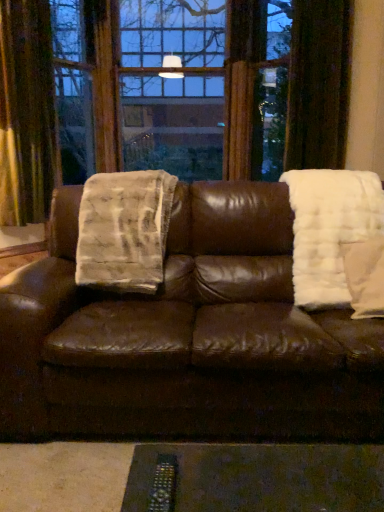
Question: Is white fluffy pillow at right shorter than velvet gold curtain at left?

Choices:
 (A) yes
 (B) no

Answer: (A)

Question: From the image's perspective, would you say white fluffy pillow at right is shown under velvet gold curtain at left?

Choices:
 (A) no
 (B) yes

Answer: (B)

Question: From the image's perspective, is white fluffy pillow at right above velvet gold curtain at left?

Choices:
 (A) yes
 (B) no

Answer: (B)

Question: From a real-world perspective, does white fluffy pillow at right stand above velvet gold curtain at left?

Choices:
 (A) no
 (B) yes

Answer: (A)

Question: Does white fluffy pillow at right have a greater height compared to velvet gold curtain at left?

Choices:
 (A) no
 (B) yes

Answer: (A)

Question: Does white fluffy pillow at right have a greater width compared to velvet gold curtain at left?

Choices:
 (A) no
 (B) yes

Answer: (B)

Question: Is velvet gold curtain at left surrounded by white fluffy blanket at right, the 1th blanket positioned from the right?

Choices:
 (A) yes
 (B) no

Answer: (B)

Question: Is white fluffy blanket at right, the 1th blanket positioned from the right, taller than velvet gold curtain at left?

Choices:
 (A) no
 (B) yes

Answer: (A)

Question: Is white fluffy blanket at right, acting as the second blanket starting from the left, positioned beyond the bounds of velvet gold curtain at left?

Choices:
 (A) no
 (B) yes

Answer: (B)

Question: Is white fluffy blanket at right, acting as the second blanket starting from the left, turned away from velvet gold curtain at left?

Choices:
 (A) no
 (B) yes

Answer: (A)

Question: Does white fluffy blanket at right, the 1th blanket positioned from the right, turn towards velvet gold curtain at left?

Choices:
 (A) no
 (B) yes

Answer: (A)

Question: From the image's perspective, is white fluffy blanket at right, the 1th blanket positioned from the right, under velvet gold curtain at left?

Choices:
 (A) yes
 (B) no

Answer: (A)

Question: From the image's perspective, would you say brown leather couch at center is shown under white fluffy pillow at right?

Choices:
 (A) no
 (B) yes

Answer: (B)